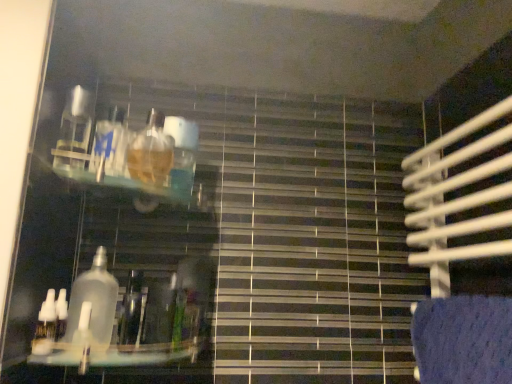
Measure the distance between point (90, 270) and camera.

A distance of 33.66 inches exists between point (90, 270) and camera.

What is the approximate width of clear glass bottle at center, which is the 1th bottle in right-to-left order?

It is 4.79 centimeters.

Identify the location of clear glass bottle at center, which is the 1th bottle in right-to-left order. (94, 300).

The image size is (512, 384). What do you see at coordinates (94, 300) in the screenshot?
I see `clear glass bottle at center, the second bottle positioned from the left` at bounding box center [94, 300].

At what (x,y) coordinates should I click in order to perform the action: click on clear plastic bottle at lower left, which appears as the 2th bottle when viewed from the right. Please return your answer as a coordinate pair (x, y). Looking at the image, I should click on (45, 326).

What do you see at coordinates (45, 326) in the screenshot? This screenshot has width=512, height=384. I see `clear plastic bottle at lower left, which appears as the 2th bottle when viewed from the right` at bounding box center [45, 326].

What is the approximate width of clear plastic bottle at lower left, which appears as the 2th bottle when viewed from the right?

clear plastic bottle at lower left, which appears as the 2th bottle when viewed from the right, is 1.38 inches wide.

You are a GUI agent. You are given a task and a screenshot of the screen. Output one action in this format:
    pyautogui.click(x=<x>, y=<y>)
    Task: Click on the clear glass bottle at center, which is the 1th bottle in right-to-left order
    
    Given the screenshot: What is the action you would take?
    pyautogui.click(x=94, y=300)

Can you confirm if clear plastic bottle at lower left, which appears as the 2th bottle when viewed from the right, is positioned to the left of clear glass bottle at center, which is the 1th bottle in right-to-left order?

Indeed, clear plastic bottle at lower left, which appears as the 2th bottle when viewed from the right, is positioned on the left side of clear glass bottle at center, which is the 1th bottle in right-to-left order.

Is clear plastic bottle at lower left, which appears as the 2th bottle when viewed from the right, closer to camera compared to clear glass bottle at center, the second bottle positioned from the left?

No, clear plastic bottle at lower left, which appears as the 2th bottle when viewed from the right, is further to the viewer.

Does point (51, 338) lie in front of point (102, 301)?

Yes, point (51, 338) is closer to viewer.

From the image's perspective, which one is positioned lower, clear plastic bottle at lower left, the 1th bottle positioned from the left, or clear glass bottle at center, the second bottle positioned from the left?

clear plastic bottle at lower left, the 1th bottle positioned from the left, appears lower in the image.

From a real-world perspective, is clear plastic bottle at lower left, the 1th bottle positioned from the left, positioned above or below clear glass bottle at center, the second bottle positioned from the left?

clear plastic bottle at lower left, the 1th bottle positioned from the left, is situated lower than clear glass bottle at center, the second bottle positioned from the left, in the real world.

In the scene shown: Is clear plastic bottle at lower left, the 1th bottle positioned from the left, thinner than clear glass bottle at center, the second bottle positioned from the left?

Yes.

Is clear plastic bottle at lower left, the 1th bottle positioned from the left, shorter than clear glass bottle at center, which is the 1th bottle in right-to-left order?

Yes.

Is clear plastic bottle at lower left, which appears as the 2th bottle when viewed from the right, bigger or smaller than clear glass bottle at center, the second bottle positioned from the left?

clear plastic bottle at lower left, which appears as the 2th bottle when viewed from the right, is smaller than clear glass bottle at center, the second bottle positioned from the left.

Is clear plastic bottle at lower left, the 1th bottle positioned from the left, completely or partially outside of clear glass bottle at center, the second bottle positioned from the left?

clear plastic bottle at lower left, the 1th bottle positioned from the left, is positioned outside clear glass bottle at center, the second bottle positioned from the left.

Is clear plastic bottle at lower left, which appears as the 2th bottle when viewed from the right, placed right next to clear glass bottle at center, the second bottle positioned from the left?

Yes, clear plastic bottle at lower left, which appears as the 2th bottle when viewed from the right, is right next to clear glass bottle at center, the second bottle positioned from the left, and making contact.

Does clear plastic bottle at lower left, the 1th bottle positioned from the left, turn towards clear glass bottle at center, which is the 1th bottle in right-to-left order?

No, clear plastic bottle at lower left, the 1th bottle positioned from the left, is not turned towards clear glass bottle at center, which is the 1th bottle in right-to-left order.

This screenshot has width=512, height=384. What are the coordinates of `bottle below the clear glass bottle at center, which is the 1th bottle in right-to-left order (from the image's perspective)` in the screenshot? It's located at (45, 326).

Considering the positions of objects clear glass bottle at center, which is the 1th bottle in right-to-left order, and clear plastic bottle at lower left, which appears as the 2th bottle when viewed from the right, in the image provided, who is more to the left, clear glass bottle at center, which is the 1th bottle in right-to-left order, or clear plastic bottle at lower left, which appears as the 2th bottle when viewed from the right,?

clear plastic bottle at lower left, which appears as the 2th bottle when viewed from the right.

Considering the positions of objects clear glass bottle at center, which is the 1th bottle in right-to-left order, and clear plastic bottle at lower left, the 1th bottle positioned from the left, in the image provided, who is in front, clear glass bottle at center, which is the 1th bottle in right-to-left order, or clear plastic bottle at lower left, the 1th bottle positioned from the left,?

clear glass bottle at center, which is the 1th bottle in right-to-left order, is closer to the camera.

Is point (82, 279) closer to camera compared to point (38, 328)?

That is False.

From the image's perspective, between clear glass bottle at center, the second bottle positioned from the left, and clear plastic bottle at lower left, which appears as the 2th bottle when viewed from the right, which one is located above?

clear glass bottle at center, the second bottle positioned from the left, is shown above in the image.

In the scene shown: From a real-world perspective, is clear glass bottle at center, which is the 1th bottle in right-to-left order, physically located above or below clear plastic bottle at lower left, the 1th bottle positioned from the left?

clear glass bottle at center, which is the 1th bottle in right-to-left order, is situated higher than clear plastic bottle at lower left, the 1th bottle positioned from the left, in the real world.

Between clear glass bottle at center, which is the 1th bottle in right-to-left order, and clear plastic bottle at lower left, the 1th bottle positioned from the left, which one has larger width?

Wider between the two is clear glass bottle at center, which is the 1th bottle in right-to-left order.

Considering the sizes of clear glass bottle at center, which is the 1th bottle in right-to-left order, and clear plastic bottle at lower left, the 1th bottle positioned from the left, in the image, is clear glass bottle at center, which is the 1th bottle in right-to-left order, taller or shorter than clear plastic bottle at lower left, the 1th bottle positioned from the left,?

Considering their sizes, clear glass bottle at center, which is the 1th bottle in right-to-left order, has more height than clear plastic bottle at lower left, the 1th bottle positioned from the left.

From the picture: Is clear glass bottle at center, the second bottle positioned from the left, smaller than clear plastic bottle at lower left, the 1th bottle positioned from the left?

Incorrect, clear glass bottle at center, the second bottle positioned from the left, is not smaller in size than clear plastic bottle at lower left, the 1th bottle positioned from the left.

Does clear glass bottle at center, which is the 1th bottle in right-to-left order, contain clear plastic bottle at lower left, which appears as the 2th bottle when viewed from the right?

That's incorrect, clear plastic bottle at lower left, which appears as the 2th bottle when viewed from the right, is not inside clear glass bottle at center, which is the 1th bottle in right-to-left order.

In the scene shown: Would you consider clear glass bottle at center, the second bottle positioned from the left, to be distant from clear plastic bottle at lower left, the 1th bottle positioned from the left?

clear glass bottle at center, the second bottle positioned from the left, is near clear plastic bottle at lower left, the 1th bottle positioned from the left, not far away.

Is clear glass bottle at center, which is the 1th bottle in right-to-left order, positioned with its back to clear plastic bottle at lower left, which appears as the 2th bottle when viewed from the right?

No, clear glass bottle at center, which is the 1th bottle in right-to-left order, is not facing away from clear plastic bottle at lower left, which appears as the 2th bottle when viewed from the right.

How many degrees apart are the facing directions of clear glass bottle at center, the second bottle positioned from the left, and clear plastic bottle at lower left, which appears as the 2th bottle when viewed from the right?

0.00759 degrees.

This screenshot has width=512, height=384. What are the coordinates of `bottle located in front of the clear plastic bottle at lower left, the 1th bottle positioned from the left` in the screenshot? It's located at (94, 300).

Locate an element on the screen. The image size is (512, 384). bottle on the right of clear plastic bottle at lower left, the 1th bottle positioned from the left is located at coordinates (94, 300).

Find the location of a particular element. The image size is (512, 384). bottle that is under the clear glass bottle at center, which is the 1th bottle in right-to-left order (from a real-world perspective) is located at coordinates (45, 326).